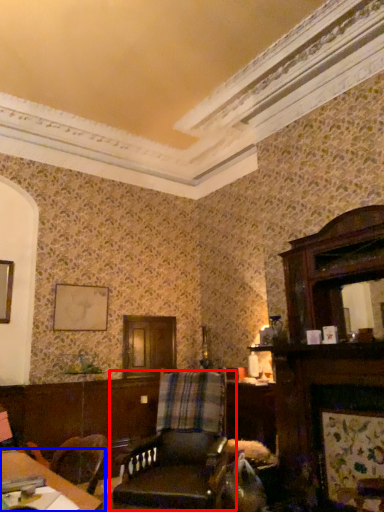
Question: Which object appears farthest to the camera in this image, chair (highlighted by a red box) or table (highlighted by a blue box)?

Choices:
 (A) chair
 (B) table

Answer: (A)